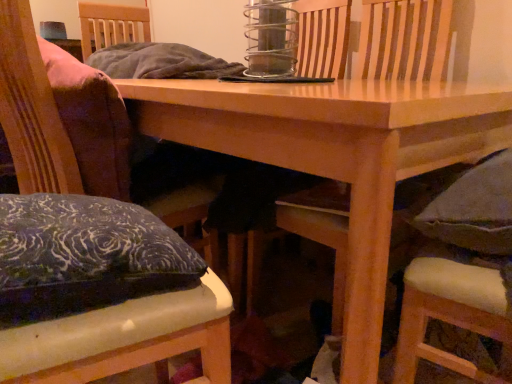
Where is `dark gray cushioned chair at lower right, positioned as the 3th chair in left-to-right order`? Image resolution: width=512 pixels, height=384 pixels. dark gray cushioned chair at lower right, positioned as the 3th chair in left-to-right order is located at coordinates (461, 270).

What is the approximate width of velvet cushioned armchair at center?

The width of velvet cushioned armchair at center is 20.84 inches.

What are the coordinates of `wooden table at center` in the screenshot? It's located at (335, 155).

Based on the photo, how many degrees apart are the facing directions of wooden table at center and dark gray cushioned chair at lower right, positioned as the 3th chair in left-to-right order?

The facing directions of wooden table at center and dark gray cushioned chair at lower right, positioned as the 3th chair in left-to-right order, are 85.5 degrees apart.

From a real-world perspective, which is physically below, wooden table at center or dark gray cushioned chair at lower right, positioned as the 3th chair in left-to-right order?

From a 3D spatial view, wooden table at center is below.

Does wooden table at center have a greater width compared to dark gray cushioned chair at lower right, positioned as the 3th chair in left-to-right order?

Correct, the width of wooden table at center exceeds that of dark gray cushioned chair at lower right, positioned as the 3th chair in left-to-right order.

Is dark gray cushioned chair at lower right, the 1th chair in the right-to-left sequence, completely or partially inside wooden table at center?

Yes, wooden table at center contains dark gray cushioned chair at lower right, the 1th chair in the right-to-left sequence.

Does point (67, 368) appear closer or farther from the camera than point (290, 163)?

Point (67, 368) is closer to the camera than point (290, 163).

In the image, is velvet cushion at left, which appears as the 1th chair when viewed from the left, positioned in front of or behind wooden table at center?

Visually, velvet cushion at left, which appears as the 1th chair when viewed from the left, is located in front of wooden table at center.

From a real-world perspective, is velvet cushion at left, which appears as the 1th chair when viewed from the left, physically below wooden table at center?

No, from a real-world perspective, velvet cushion at left, which appears as the 1th chair when viewed from the left, is not beneath wooden table at center.

Image resolution: width=512 pixels, height=384 pixels. I want to click on table behind the velvet cushion at left, which appears as the third chair when viewed from the right, so click(x=335, y=155).

How far apart are velvet cushioned armchair at center and wooden table at center?

A distance of 32.31 inches exists between velvet cushioned armchair at center and wooden table at center.

Identify the location of table in front of the velvet cushioned armchair at center. (335, 155).

Is velvet cushioned armchair at center facing towards wooden table at center?

Yes, velvet cushioned armchair at center faces towards wooden table at center.

Can you confirm if dark gray cushioned chair at lower right, the 1th chair in the right-to-left sequence, is taller than wooden table at center?

Correct, dark gray cushioned chair at lower right, the 1th chair in the right-to-left sequence, is much taller as wooden table at center.

How distant is dark gray cushioned chair at lower right, positioned as the 3th chair in left-to-right order, from wooden table at center?

A distance of 9.55 inches exists between dark gray cushioned chair at lower right, positioned as the 3th chair in left-to-right order, and wooden table at center.

Considering the relative positions of dark gray cushioned chair at lower right, positioned as the 3th chair in left-to-right order, and wooden table at center in the image provided, is dark gray cushioned chair at lower right, positioned as the 3th chair in left-to-right order, to the left of wooden table at center from the viewer's perspective?

In fact, dark gray cushioned chair at lower right, positioned as the 3th chair in left-to-right order, is to the right of wooden table at center.

Considering the sizes of dark gray cushioned chair at lower right, the 1th chair in the right-to-left sequence, and wooden table at center in the image, is dark gray cushioned chair at lower right, the 1th chair in the right-to-left sequence, bigger or smaller than wooden table at center?

dark gray cushioned chair at lower right, the 1th chair in the right-to-left sequence, is smaller than wooden table at center.

Does velvet cushion at left, which is counted as the second chair, starting from the left, turn towards velvet cushioned armchair at center?

No, velvet cushion at left, which is counted as the second chair, starting from the left, is not turned towards velvet cushioned armchair at center.

Which object is wider, velvet cushion at left, which is counted as the second chair, starting from the left, or velvet cushioned armchair at center?

velvet cushioned armchair at center.

From the image's perspective, which is below, velvet cushion at left, which is counted as the second chair, starting from the left, or velvet cushioned armchair at center?

velvet cushion at left, which is counted as the second chair, starting from the left.

Is velvet cushion at left, which appears as the 1th chair when viewed from the left, facing away from velvet cushion at left, which is counted as the second chair, starting from the left?

Correct, velvet cushion at left, which appears as the 1th chair when viewed from the left, is looking away from velvet cushion at left, which is counted as the second chair, starting from the left.

Which point is more forward, (104, 169) or (67, 291)?

Positioned in front is point (67, 291).

Is velvet cushion at left, which appears as the third chair when viewed from the right, taller or shorter than velvet cushion at left, the 2th chair positioned from the right?

velvet cushion at left, which appears as the third chair when viewed from the right, is taller than velvet cushion at left, the 2th chair positioned from the right.

From the image's perspective, which is above, velvet cushion at left, which appears as the 1th chair when viewed from the left, or velvet cushion at left, which is counted as the second chair, starting from the left?

velvet cushion at left, which is counted as the second chair, starting from the left, appears higher in the image.

Is dark gray cushioned chair at lower right, positioned as the 3th chair in left-to-right order, bigger than velvet cushion at left, which appears as the 1th chair when viewed from the left?

No, dark gray cushioned chair at lower right, positioned as the 3th chair in left-to-right order, is not bigger than velvet cushion at left, which appears as the 1th chair when viewed from the left.

Is dark gray cushioned chair at lower right, the 1th chair in the right-to-left sequence, directly adjacent to velvet cushion at left, which appears as the third chair when viewed from the right?

No, dark gray cushioned chair at lower right, the 1th chair in the right-to-left sequence, is not next to velvet cushion at left, which appears as the third chair when viewed from the right.

Is velvet cushion at left, which appears as the third chair when viewed from the right, at the back of dark gray cushioned chair at lower right, positioned as the 3th chair in left-to-right order?

No, dark gray cushioned chair at lower right, positioned as the 3th chair in left-to-right order,'s orientation is not away from velvet cushion at left, which appears as the third chair when viewed from the right.

From the image's perspective, which is above, dark gray cushioned chair at lower right, positioned as the 3th chair in left-to-right order, or velvet cushion at left, which appears as the 1th chair when viewed from the left?

dark gray cushioned chair at lower right, positioned as the 3th chair in left-to-right order, from the image's perspective.

Find the location of a particular element. The height and width of the screenshot is (384, 512). chair on the right of the wooden table at center is located at coordinates (461, 270).

Starting from the wooden table at center, which chair is the 2nd one to the left? Please provide its 2D coordinates.

[(128, 340)]

Estimate the real-world distances between objects in this image. Which object is further from velvet cushioned armchair at center, wooden table at center or velvet cushion at left, which appears as the third chair when viewed from the right?

The object further to velvet cushioned armchair at center is velvet cushion at left, which appears as the third chair when viewed from the right.

Considering their positions, is dark gray cushioned chair at lower right, the 1th chair in the right-to-left sequence, positioned further to velvet cushion at left, which appears as the 1th chair when viewed from the left, than velvet cushioned armchair at center?

velvet cushioned armchair at center is positioned further to the anchor velvet cushion at left, which appears as the 1th chair when viewed from the left.

When comparing their distances from velvet cushion at left, which appears as the 1th chair when viewed from the left, does dark gray cushioned chair at lower right, the 1th chair in the right-to-left sequence, or wooden table at center seem closer?

Based on the image, wooden table at center appears to be nearer to velvet cushion at left, which appears as the 1th chair when viewed from the left.

From the image, which object appears to be farther from velvet cushioned armchair at center, wooden table at center or velvet cushion at left, the 2th chair positioned from the right?

Among the two, velvet cushion at left, the 2th chair positioned from the right, is located further to velvet cushioned armchair at center.

When comparing their distances from velvet cushion at left, which appears as the third chair when viewed from the right, does wooden table at center or velvet cushioned armchair at center seem closer?

The object closer to velvet cushion at left, which appears as the third chair when viewed from the right, is wooden table at center.

Which object lies further to the anchor point wooden table at center, velvet cushion at left, which appears as the third chair when viewed from the right, or velvet cushion at left, which is counted as the second chair, starting from the left?

Based on the image, velvet cushion at left, which appears as the third chair when viewed from the right, appears to be further to wooden table at center.

Estimate the real-world distances between objects in this image. Which object is further from velvet cushion at left, which is counted as the second chair, starting from the left, velvet cushion at left, which appears as the third chair when viewed from the right, or dark gray cushioned chair at lower right, positioned as the 3th chair in left-to-right order?

dark gray cushioned chair at lower right, positioned as the 3th chair in left-to-right order, lies further to velvet cushion at left, which is counted as the second chair, starting from the left, than the other object.

When comparing their distances from velvet cushion at left, which appears as the 1th chair when viewed from the left, does velvet cushioned armchair at center or dark gray cushioned chair at lower right, positioned as the 3th chair in left-to-right order, seem closer?

Based on the image, dark gray cushioned chair at lower right, positioned as the 3th chair in left-to-right order, appears to be nearer to velvet cushion at left, which appears as the 1th chair when viewed from the left.

Image resolution: width=512 pixels, height=384 pixels. In order to click on chair situated between velvet cushion at left, which appears as the third chair when viewed from the right, and velvet cushioned armchair at center from left to right in this screenshot , I will do `click(101, 291)`.

This screenshot has width=512, height=384. I want to click on table between velvet cushion at left, the 2th chair positioned from the right, and dark gray cushioned chair at lower right, the 1th chair in the right-to-left sequence, from left to right, so click(x=335, y=155).

This screenshot has width=512, height=384. In order to click on table situated between velvet cushion at left, which appears as the 1th chair when viewed from the left, and velvet cushioned armchair at center from left to right in this screenshot , I will do `click(335, 155)`.

What are the coordinates of `table between velvet cushion at left, which appears as the third chair when viewed from the right, and dark gray cushioned chair at lower right, positioned as the 3th chair in left-to-right order, in the horizontal direction` in the screenshot? It's located at (335, 155).